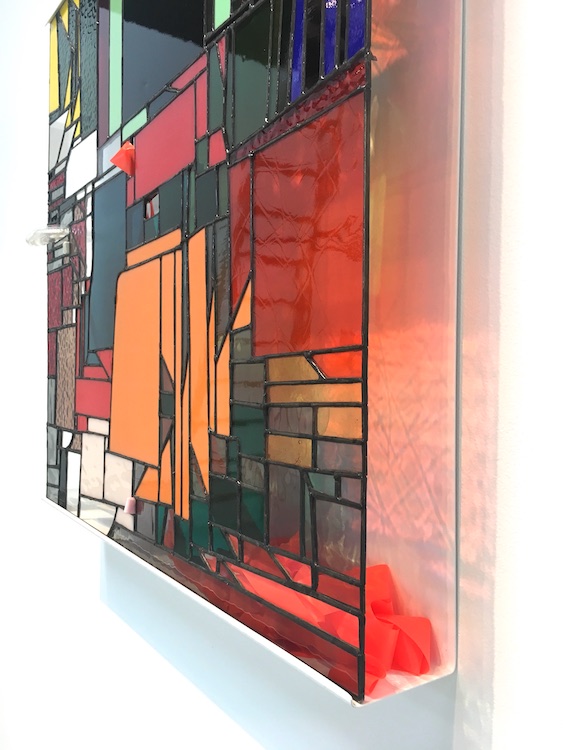
What are the coordinates of `wall` in the screenshot? It's located at (82, 550).